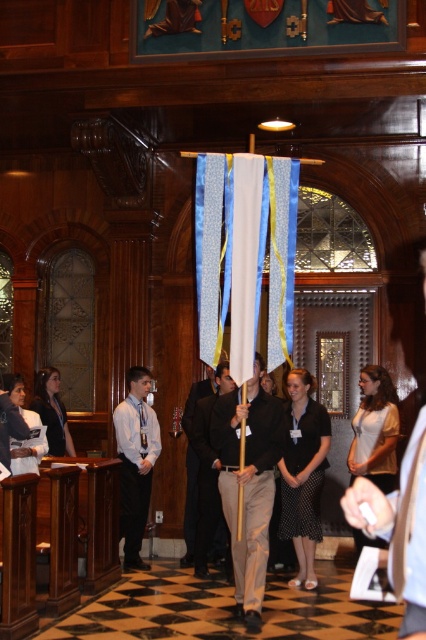
You are standing in the ceremonial room and want to determine which of the two points, point (x=244, y=499) or point (x=199, y=564), is closer to your current position. Based on the image, which point is nearer to you?

Point (x=244, y=499) is closer to the camera than point (x=199, y=564), so it is nearer to your current position.

You are standing in the ceremonial space and need to place a small decorative item on the white fabric at center. According to the image, where exactly should you place it?

The white fabric at center is located at point (400, 529), so you should place the item there.

You are attending a formal event in this room and notice two items at the center of the scene. Which item takes up more visual space? The matte black shirt at center or the white fabric at center?

The matte black shirt at center has a larger size compared to the white fabric at center, so it takes up more visual space.